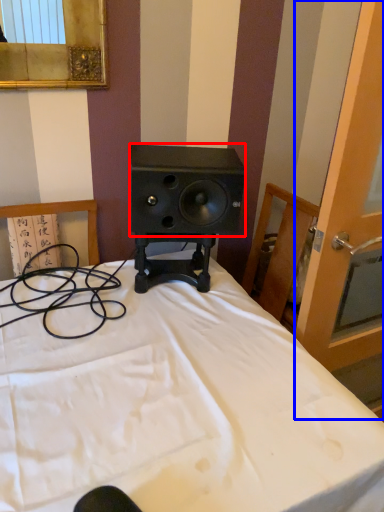
Question: Which of the following is the farthest to the observer, speaker (highlighted by a red box) or screen door (highlighted by a blue box)?

Choices:
 (A) speaker
 (B) screen door

Answer: (A)